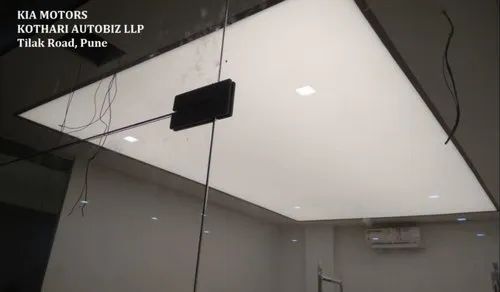
Where is `office projector`? office projector is located at coordinates (395, 241).